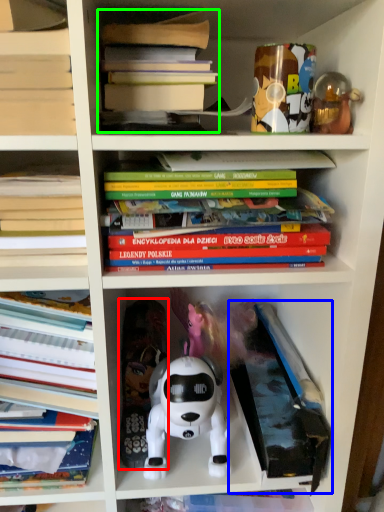
Question: Which object is positioned closest to toy (highlighted by a red box)? Select from paperback book (highlighted by a blue box) and book (highlighted by a green box).

Choices:
 (A) paperback book
 (B) book

Answer: (A)